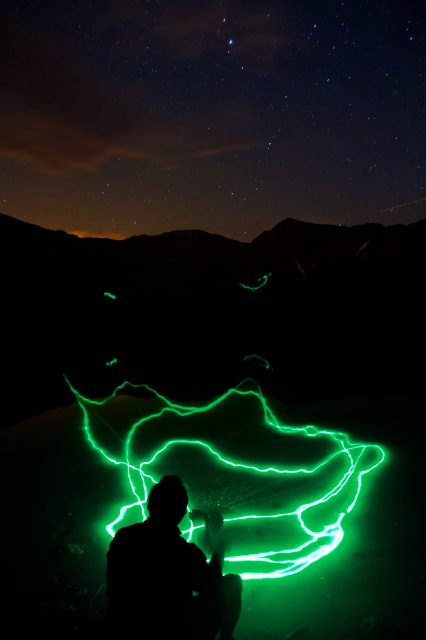
You are an astronomer observing the night sky in the image. You notice a point labeled as point (244, 476). What color is the light at this point?

The light at point (244, 476) is neon green.

You are standing in the night scene looking at the two points labeled as point (x=357, y=442) and point (x=172, y=632). Which point is closer to you?

Point (x=357, y=442) is closer to you because it is further to the viewer than point (x=172, y=632).